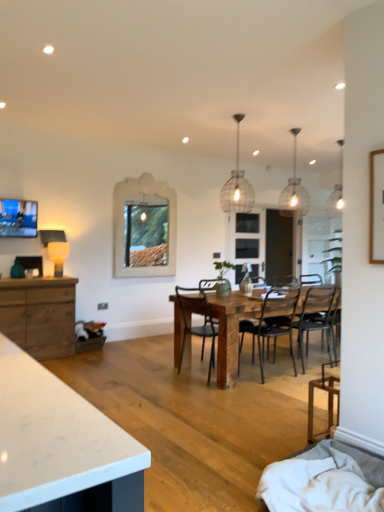
What are the coordinates of `vacant space to the left of metallic black chair at center, the 3th chair from the back` in the screenshot? It's located at (157, 375).